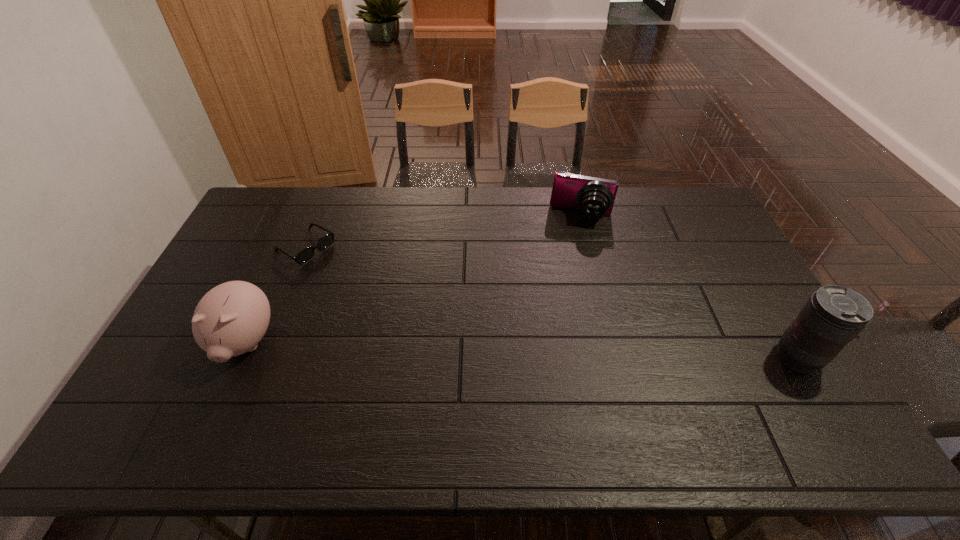
You are a GUI agent. You are given a task and a screenshot of the screen. Output one action in this format:
    pyautogui.click(x=<x>, y=<y>)
    Task: Click on the free spot between the piggy bank and the sunglasses
    
    Given the screenshot: What is the action you would take?
    pyautogui.click(x=276, y=295)

The width and height of the screenshot is (960, 540). Find the location of `empty space between the rightmost object and the second object from right to left`. empty space between the rightmost object and the second object from right to left is located at coordinates (689, 287).

Identify the location of free area in between the second tallest object and the camera. The width and height of the screenshot is (960, 540). (414, 279).

Where is `vacant point located between the second shortest object and the tallest object`? vacant point located between the second shortest object and the tallest object is located at coordinates (689, 287).

The image size is (960, 540). Find the location of `vacant region between the telephoto lens and the second tallest object`. vacant region between the telephoto lens and the second tallest object is located at coordinates (521, 350).

You are a GUI agent. You are given a task and a screenshot of the screen. Output one action in this format:
    pyautogui.click(x=<x>, y=<y>)
    Task: Click on the blank region between the second tallest object and the sunglasses
    
    Given the screenshot: What is the action you would take?
    coord(276,295)

Where is `vacant space in between the third tallest object and the telephoto lens`? The width and height of the screenshot is (960, 540). vacant space in between the third tallest object and the telephoto lens is located at coordinates (689, 287).

You are a GUI agent. You are given a task and a screenshot of the screen. Output one action in this format:
    pyautogui.click(x=<x>, y=<y>)
    Task: Click on the vacant region between the second shortest object and the sunglasses
    The width and height of the screenshot is (960, 540).
    Given the screenshot: What is the action you would take?
    pyautogui.click(x=444, y=232)

You are a GUI agent. You are given a task and a screenshot of the screen. Output one action in this format:
    pyautogui.click(x=<x>, y=<y>)
    Task: Click on the free space between the camera and the piggy bank
    
    Given the screenshot: What is the action you would take?
    pyautogui.click(x=414, y=279)

The width and height of the screenshot is (960, 540). In order to click on free space between the sunglasses and the rightmost object in this screenshot , I will do `click(551, 302)`.